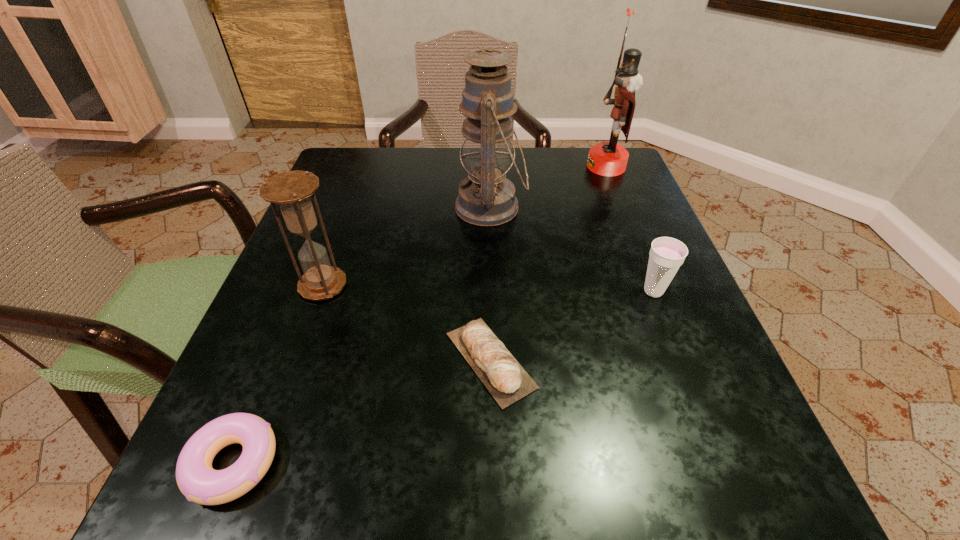
Where is `object that stands as the second closest to the nearest object`? object that stands as the second closest to the nearest object is located at coordinates (291, 190).

You are a GUI agent. You are given a task and a screenshot of the screen. Output one action in this format:
    pyautogui.click(x=<x>, y=<y>)
    Task: Click on the free spot that satisfies the following two spatial constraints: 1. on the front side of the hourglass; 2. on the right side of the cup
    This screenshot has width=960, height=540.
    Given the screenshot: What is the action you would take?
    pyautogui.click(x=321, y=291)

Where is `free space that satisfies the following two spatial constraints: 1. on the front side of the oil lamp; 2. on the left side of the third shortest object`? The width and height of the screenshot is (960, 540). free space that satisfies the following two spatial constraints: 1. on the front side of the oil lamp; 2. on the left side of the third shortest object is located at coordinates (493, 291).

At what (x,y) coordinates should I click in order to perform the action: click on vacant space that satisfies the following two spatial constraints: 1. on the front side of the cup; 2. on the right side of the hourglass. Please return your answer as a coordinate pair (x, y). The height and width of the screenshot is (540, 960). Looking at the image, I should click on (321, 291).